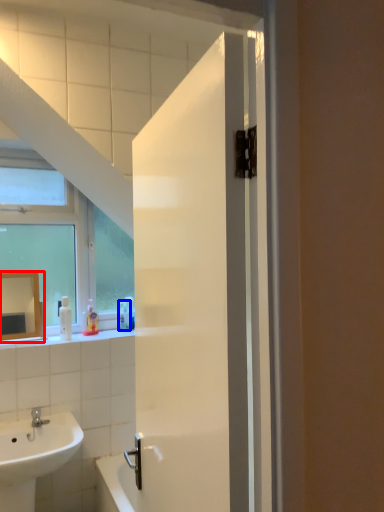
Question: Which of the following is the closest to the observer, mirror (highlighted by a red box) or toiletry (highlighted by a blue box)?

Choices:
 (A) mirror
 (B) toiletry

Answer: (A)